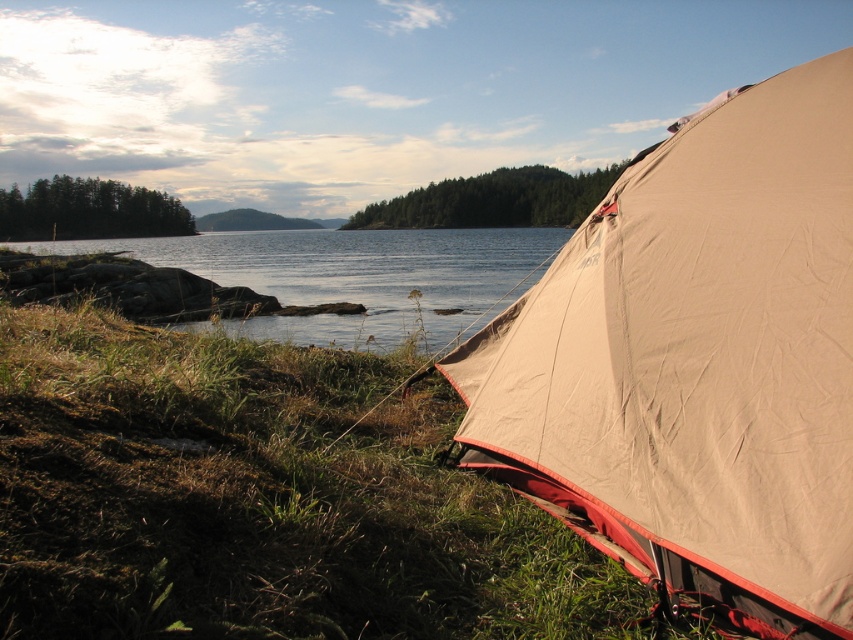
Does beige canvas tent at lower right appear over clear water at lower left?

Actually, beige canvas tent at lower right is below clear water at lower left.

Does point (492, 449) come farther from viewer compared to point (395, 243)?

No.

The height and width of the screenshot is (640, 853). I want to click on beige canvas tent at lower right, so click(697, 362).